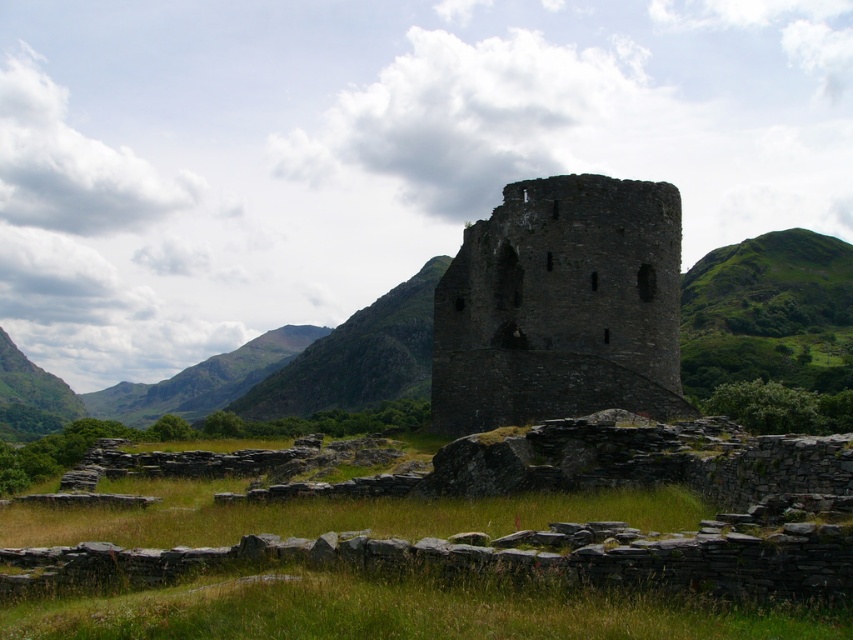
Does green grass at center appear under green grassy hill at center?

Yes.

Between green grass at center and green grassy hill at center, which one appears on the right side from the viewer's perspective?

Positioned to the right is green grass at center.

Does point (795, 579) come closer to viewer compared to point (239, 362)?

Yes, it is in front of point (239, 362).

The image size is (853, 640). Identify the location of green grass at center. (556, 538).

Does green grass at center come behind dark gray stone tower at center?

No, it is not.

Is point (202, 568) farther from viewer compared to point (492, 244)?

No.

Which is in front, point (622, 576) or point (657, 396)?

Point (622, 576) is more forward.

Locate an element on the screen. The width and height of the screenshot is (853, 640). green grass at center is located at coordinates (556, 538).

Between point (590, 189) and point (393, 342), which one is positioned behind?

The point (393, 342) is behind.

Is dark gray stone tower at center above green grassy hill at center?

Indeed, dark gray stone tower at center is positioned over green grassy hill at center.

Is point (456, 324) more distant than point (700, 326)?

No, it is in front of (700, 326).

The width and height of the screenshot is (853, 640). I want to click on dark gray stone tower at center, so click(x=561, y=307).